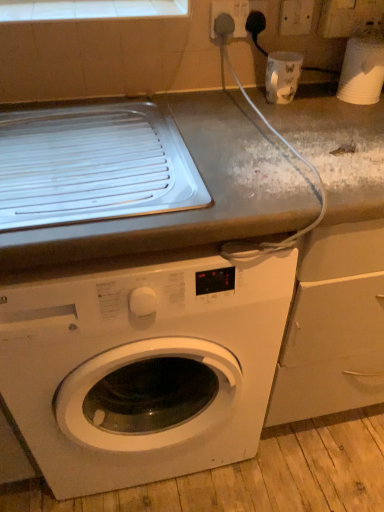
Where is `vacant area that lies between white plastic cup at upper right, the 2th appliance in the left-to-right sequence, and white glossy cup at upper right, arranged as the 2th appliance when viewed from the right`? The height and width of the screenshot is (512, 384). vacant area that lies between white plastic cup at upper right, the 2th appliance in the left-to-right sequence, and white glossy cup at upper right, arranged as the 2th appliance when viewed from the right is located at coordinates (317, 100).